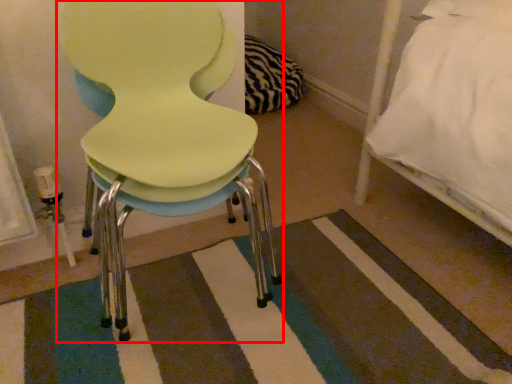
Question: From the image's perspective, where is chair (annotated by the red box) located in relation to mat in the image?

Choices:
 (A) below
 (B) above

Answer: (B)